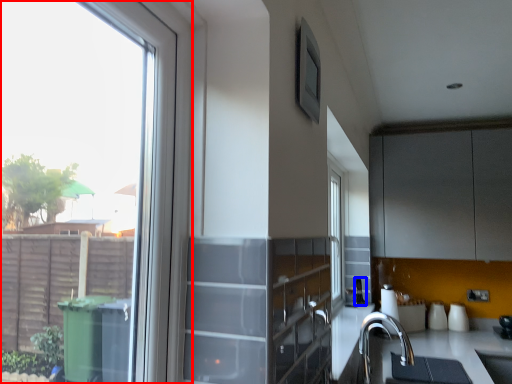
Question: Which object is further to the camera taking this photo, window (highlighted by a red box) or appliance (highlighted by a blue box)?

Choices:
 (A) window
 (B) appliance

Answer: (B)